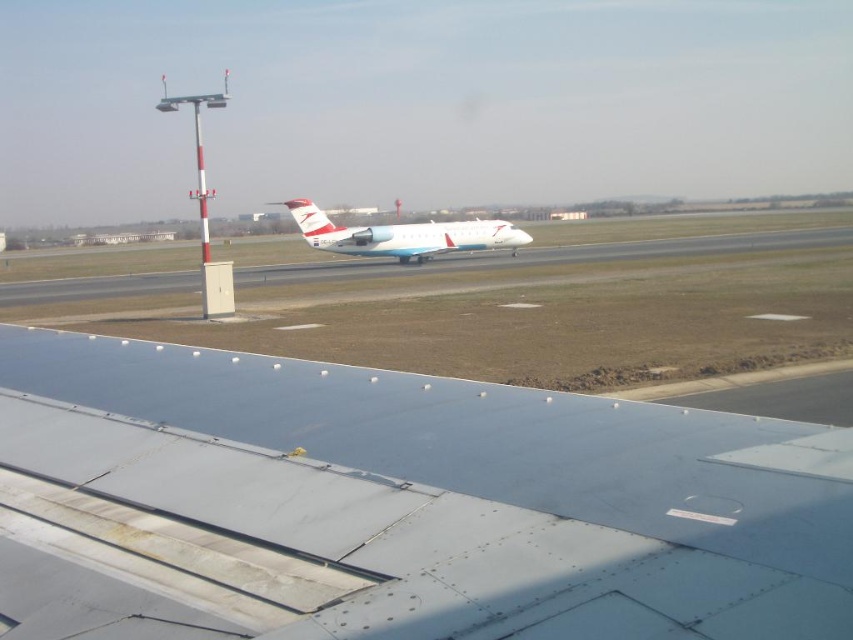
You are a pilot preparing for takeoff and notice two objects in your line of sight. You see the metallic gray wing at lower center and the white glossy airplane at center. Which object is closer to you based on their size?

The metallic gray wing at lower center is closer to you because it appears smaller than the white glossy airplane at center, which is larger and therefore farther away according to the size comparison provided.

You are a pilot observing the airport scene from another aircraft. You notice a metallic gray wing at lower center and a white glossy airplane at center. Which object has a smaller width?

The metallic gray wing at lower center has a smaller width than the white glossy airplane at center according to the description.